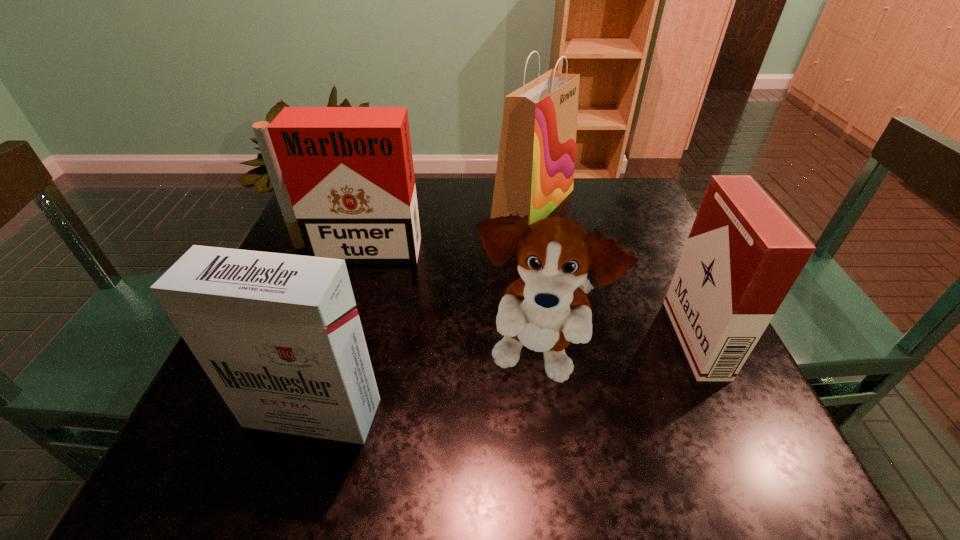
Locate an element on the screen. the tallest object is located at coordinates click(535, 169).

Find the location of a particular element. the farthest object is located at coordinates (535, 169).

Find the location of a particular element. The height and width of the screenshot is (540, 960). the farthest cigarette_case is located at coordinates (344, 179).

The image size is (960, 540). Identify the location of puppy. (546, 309).

You are a GUI agent. You are given a task and a screenshot of the screen. Output one action in this format:
    pyautogui.click(x=<x>, y=<y>)
    Task: Click on the nearest cigarette_case
    
    Given the screenshot: What is the action you would take?
    pyautogui.click(x=279, y=335)

At what (x,y) coordinates should I click in order to perform the action: click on the rightmost cigarette_case. Please return your answer as a coordinate pair (x, y). The width and height of the screenshot is (960, 540). Looking at the image, I should click on (743, 254).

You are a GUI agent. You are given a task and a screenshot of the screen. Output one action in this format:
    pyautogui.click(x=<x>, y=<y>)
    Task: Click on the rightmost object
    This screenshot has width=960, height=540.
    Given the screenshot: What is the action you would take?
    pyautogui.click(x=743, y=254)

In order to click on free space located 0.230m on the left of the farthest object in this screenshot , I will do `click(403, 205)`.

Find the location of a particular element. This screenshot has height=540, width=960. vacant space located on the front-facing side of the fourth nearest object is located at coordinates (315, 370).

Find the location of a particular element. free space located on the face of the puppy is located at coordinates (545, 438).